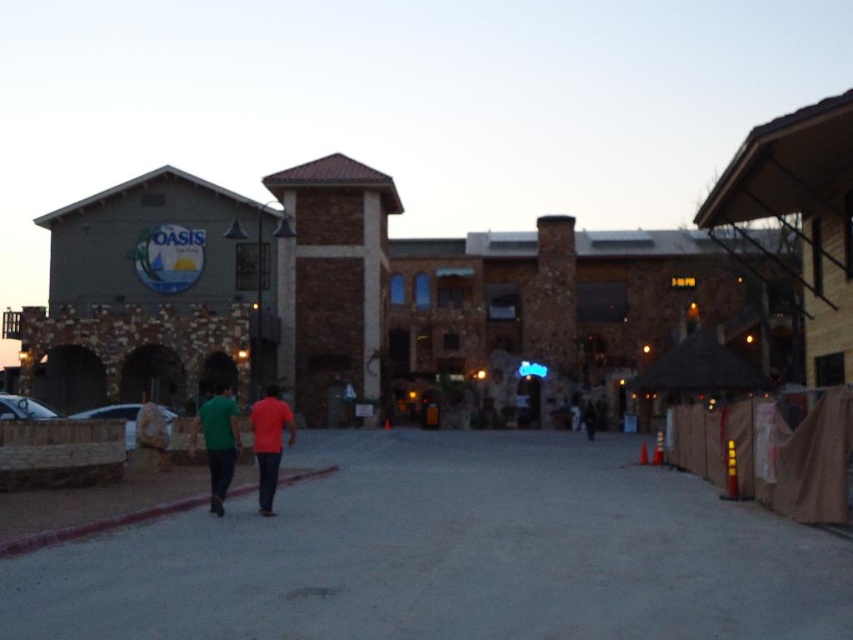
Is green matte shirt at center bigger than dark blue jeans at center?

Yes.

Between green matte shirt at center and dark blue jeans at center, which one appears on the right side from the viewer's perspective?

From the viewer's perspective, dark blue jeans at center appears more on the right side.

Between point (218, 492) and point (595, 432), which one is positioned in front?

Positioned in front is point (218, 492).

The height and width of the screenshot is (640, 853). Find the location of `green matte shirt at center`. green matte shirt at center is located at coordinates (218, 442).

Which is behind, point (392, 493) or point (231, 420)?

Point (392, 493)

Can you confirm if gray asphalt pavement at center is positioned above green fabric shirt at center?

No, gray asphalt pavement at center is not above green fabric shirt at center.

Who is more distant from viewer, [582,608] or [253,440]?

The point [253,440] is more distant.

At what (x,y) coordinates should I click in order to perform the action: click on gray asphalt pavement at center. Please return your answer as a coordinate pair (x, y). The height and width of the screenshot is (640, 853). Looking at the image, I should click on (450, 554).

Based on the photo, is green fabric shirt at center positioned before matte red shirt at center?

That is False.

In the scene shown: Measure the distance between green fabric shirt at center and camera.

green fabric shirt at center is 40.71 feet away from camera.

Is point (218, 436) positioned before point (279, 403)?

That is True.

You are a GUI agent. You are given a task and a screenshot of the screen. Output one action in this format:
    pyautogui.click(x=<x>, y=<y>)
    Task: Click on the green fabric shirt at center
    This screenshot has height=640, width=853.
    Given the screenshot: What is the action you would take?
    pyautogui.click(x=219, y=442)